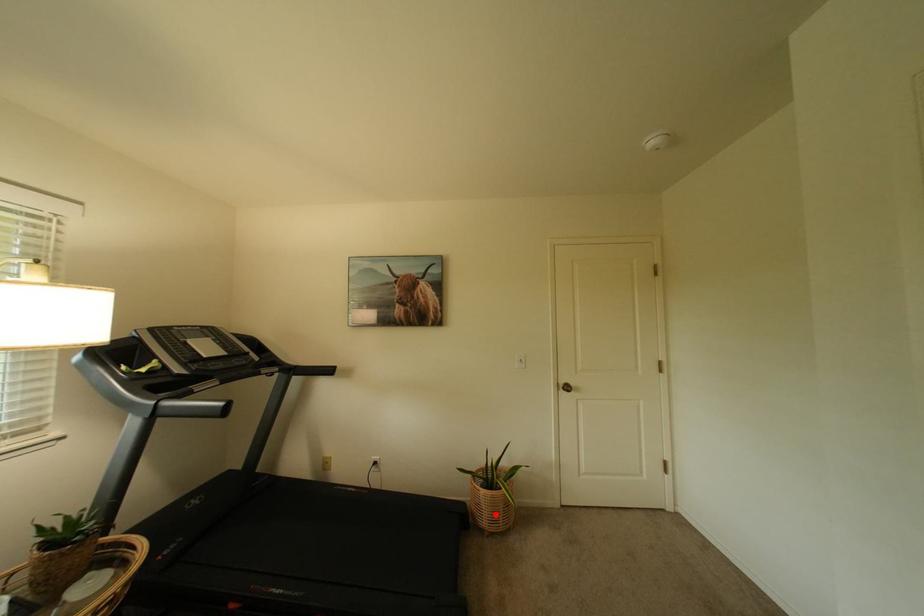
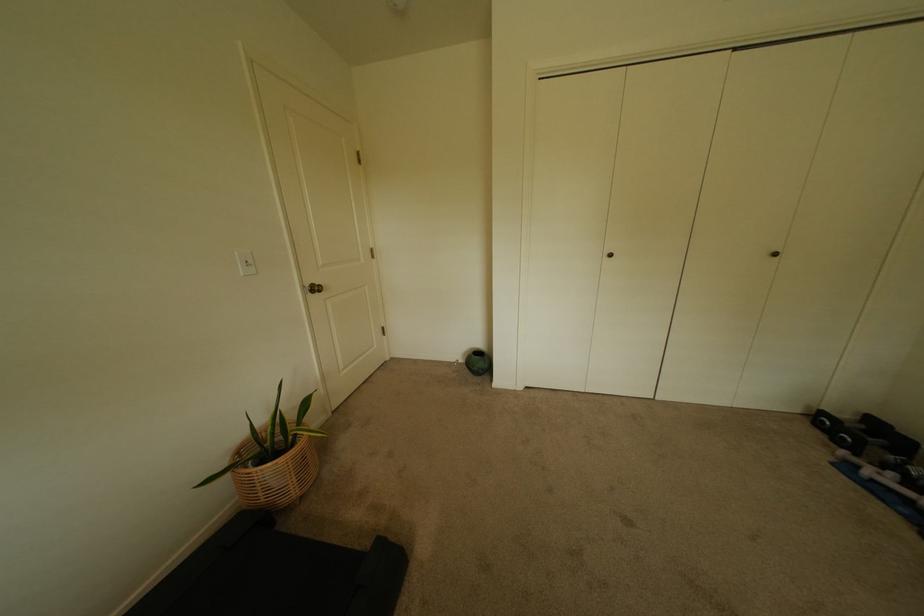
Question: I am providing you with two images of the same scene from different viewpoints. Image1 has a red point marked. In image2, the corresponding 3D location appears at what relative position? Reply with the corresponding letter.

Choices:
 (A) Closer
 (B) Farther

Answer: (A)